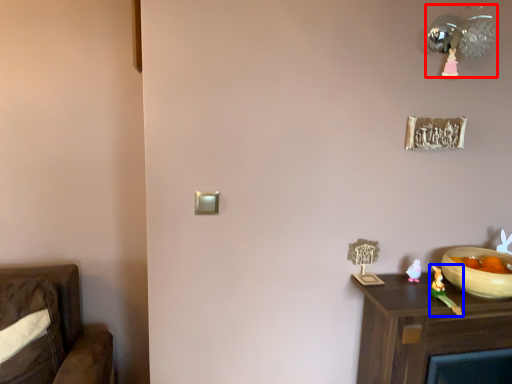
Question: Which object appears farthest to the camera in this image, light fixture (highlighted by a red box) or toy (highlighted by a blue box)?

Choices:
 (A) light fixture
 (B) toy

Answer: (B)